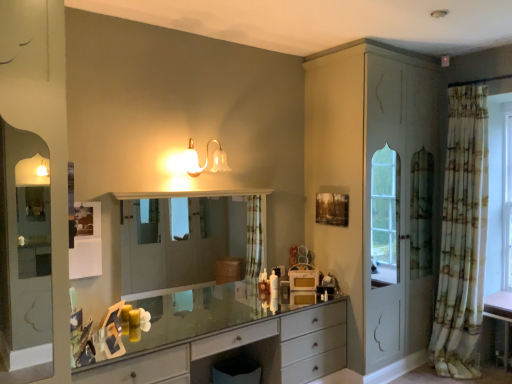
At what (x,y) coordinates should I click in order to perform the action: click on vacant space situated above clear glass mirror at center (from a real-world perspective). Please return your answer as a coordinate pair (x, y). Looking at the image, I should click on (200, 192).